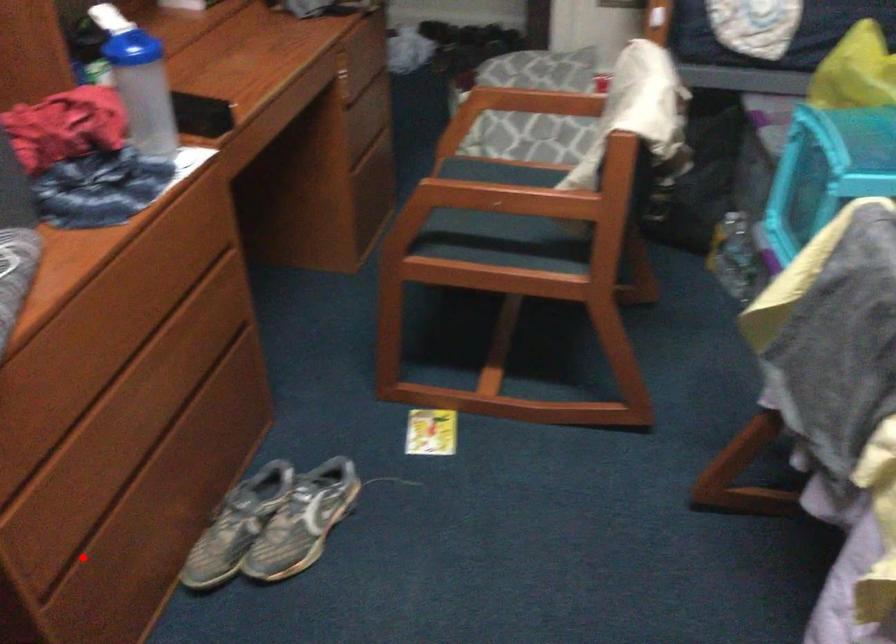
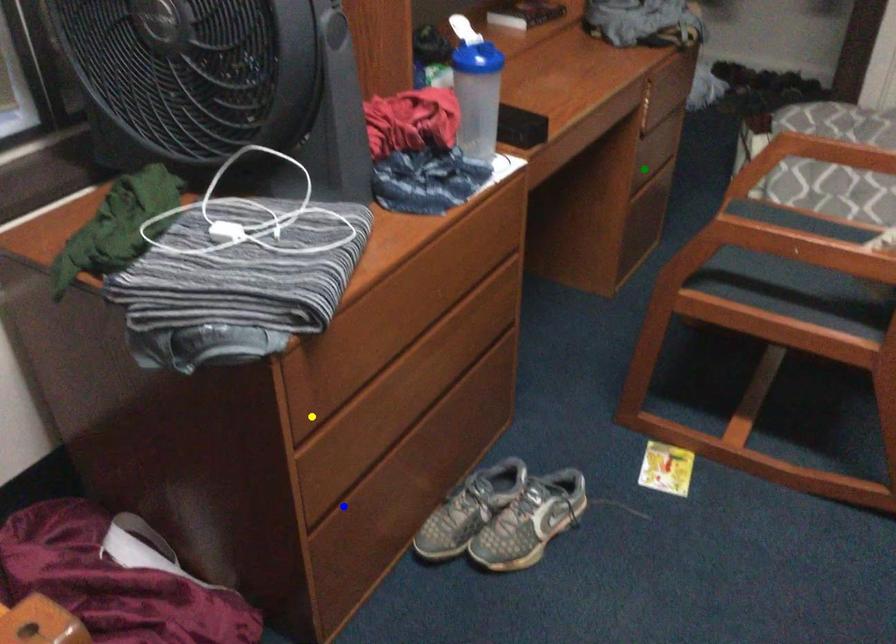
Question: I am providing you with two images of the same scene from different viewpoints. A red point is marked on the first image. You are given multiple points on the second image. In image 2, which mark is for the same physical point as the one in image 1?

Choices:
 (A) green point
 (B) yellow point
 (C) blue point

Answer: (C)